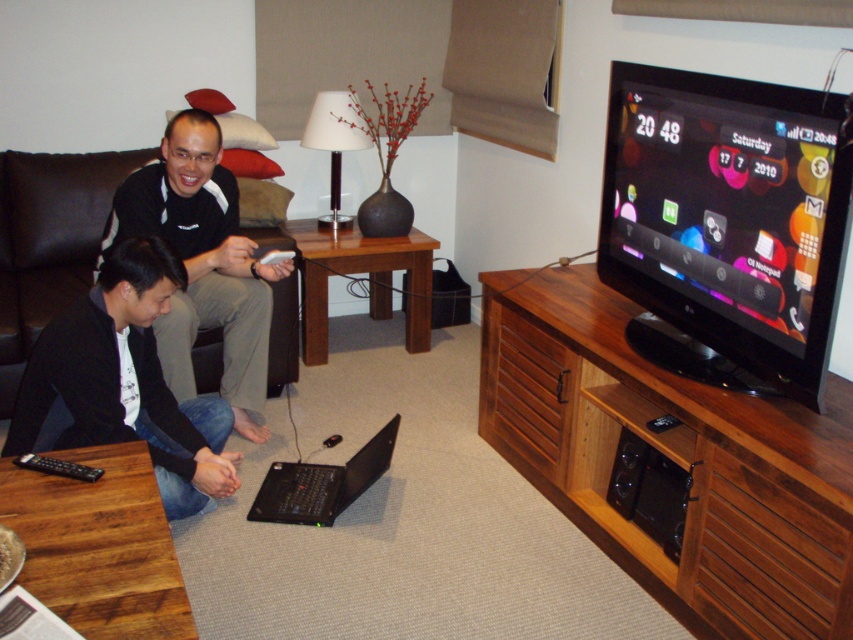
You are a visitor in the living room and want to hand the black plastic remote at lower left to the person on the couch who is looking at the black glossy tv at upper right. Can you directly hand it to them without moving the remote from its current position?

The black glossy tv at upper right is located above the black plastic remote at lower left, so the remote is positioned below the TV. Since the person on the couch is looking at the TV, you can directly hand the black plastic remote at lower left to them without moving it as it is already in a reachable position below the TV.

You are a visitor in the living room and want to hand the black plastic remote at lower left to the person watching the black glossy tv at upper right. Can you reach the remote without moving from your current position?

The black glossy tv at upper right is closer to the viewer than the black plastic remote at lower left, so the remote is farther away. If you are positioned near the tv, you might need to stretch or move slightly to reach the remote at lower left.

You are a delivery person who needs to place a small package on the coffee table. The package must be placed exactly where the black matte jacket at lower left is located. Is this possible?

The black matte jacket at lower left is located at point (123,381). Since the coffee table is in the foreground, it is possible to place the package there as long as the coordinates align with the table surface.